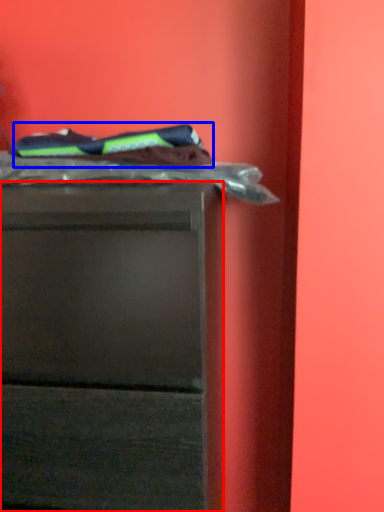
Question: Which of the following is the closest to the observer, chest of drawers (highlighted by a red box) or laundry (highlighted by a blue box)?

Choices:
 (A) chest of drawers
 (B) laundry

Answer: (A)